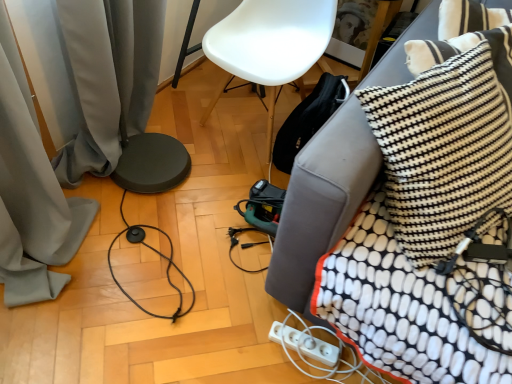
Question: Is white textured blanket at right situated inside black fabric couch at lower right or outside?

Choices:
 (A) inside
 (B) outside

Answer: (A)

Question: Is white textured blanket at right bigger or smaller than black fabric couch at lower right?

Choices:
 (A) big
 (B) small

Answer: (B)

Question: Which is farther from the gray fabric curtain at lower left?

Choices:
 (A) white plastic power strip at lower right
 (B) black and white woven pillow at upper right
 (C) white plastic chair at center
 (D) white textured blanket at right
 (E) black fabric couch at lower right

Answer: (D)

Question: Estimate the real-world distances between objects in this image. Which object is closer to the black fabric couch at lower right?

Choices:
 (A) white plastic extension cord at lower right
 (B) white plastic power strip at lower right
 (C) gray fabric curtain at lower left
 (D) black and white woven pillow at upper right
 (E) white plastic chair at center

Answer: (D)